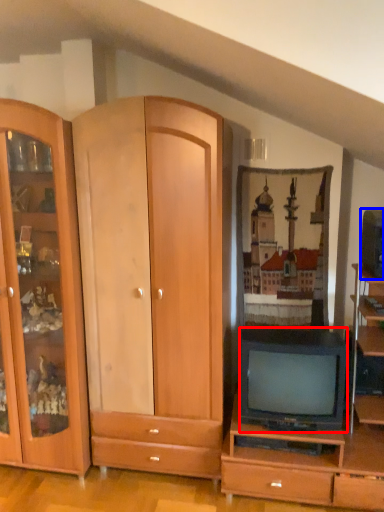
Question: Among these objects, which one is farthest to the camera, television (highlighted by a red box) or television (highlighted by a blue box)?

Choices:
 (A) television
 (B) television

Answer: (A)